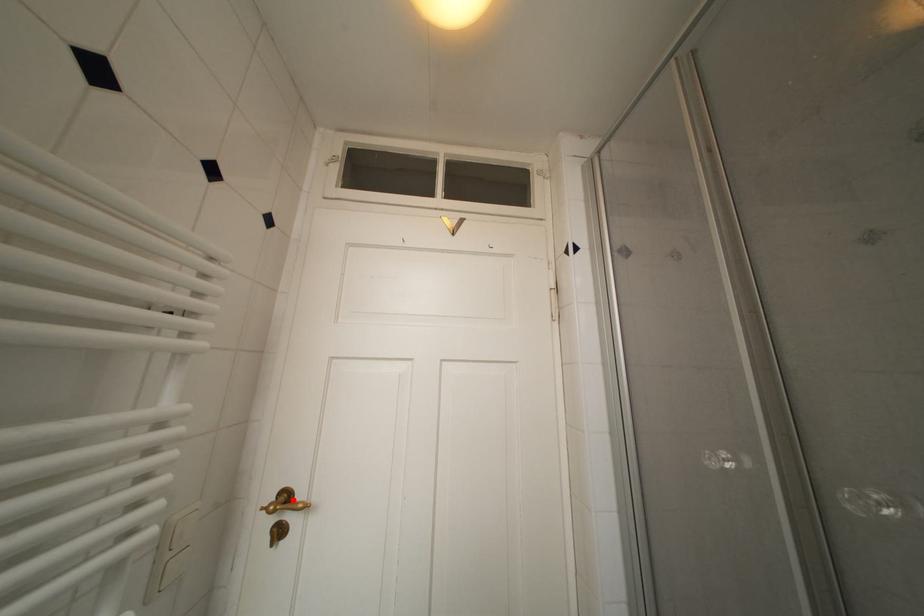
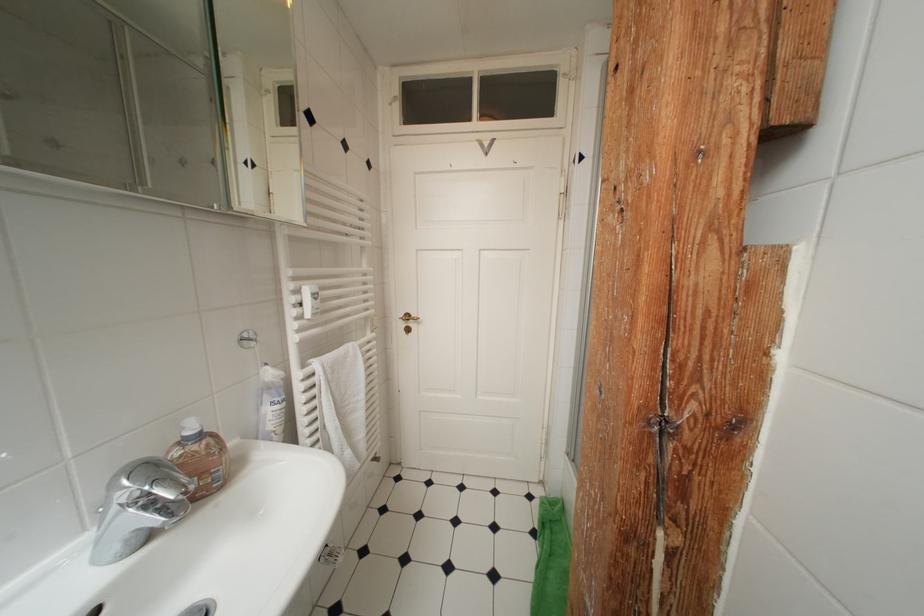
Where in the second image is the point corresponding to the highlighted location from the first image?

(415, 320)